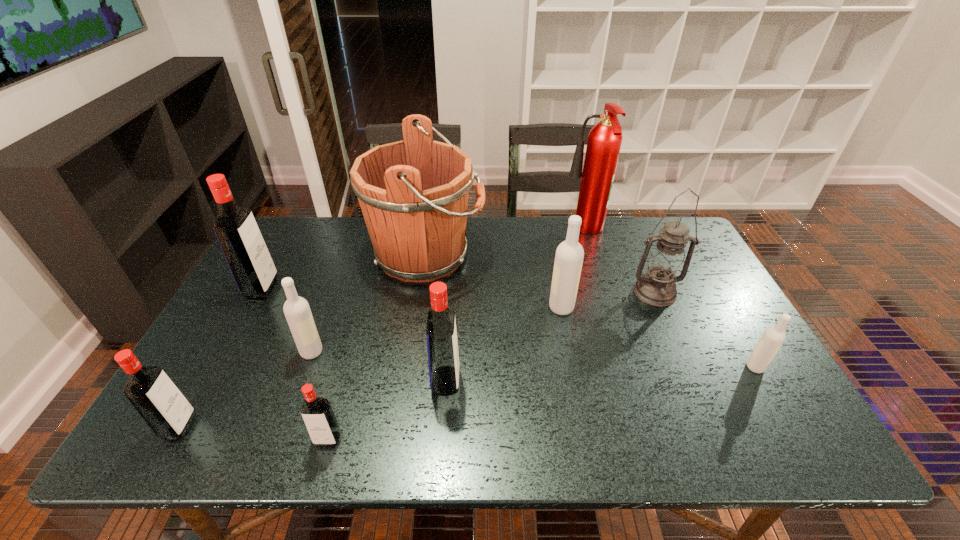
Point out which object is positioned as the nearest to the bucket. Please provide its 2D coordinates. Your answer should be formatted as a tuple, i.e. [(x, y)], where the tuple contains the x and y coordinates of a point satisfying the conditions above.

[(569, 256)]

This screenshot has width=960, height=540. What are the coordinates of `vodka object that ranks as the sixth closest to the smallest red vodka` in the screenshot? It's located at (773, 338).

Where is `vodka that is the third closest one to the rightmost vodka`? This screenshot has width=960, height=540. vodka that is the third closest one to the rightmost vodka is located at coordinates (321, 423).

Select which red vodka appears as the third closest to the third vodka from right to left. Please provide its 2D coordinates. Your answer should be formatted as a tuple, i.e. [(x, y)], where the tuple contains the x and y coordinates of a point satisfying the conditions above.

[(249, 260)]

Point out which red vodka is positioned as the nearest to the second biggest red vodka. Please provide its 2D coordinates. Your answer should be formatted as a tuple, i.e. [(x, y)], where the tuple contains the x and y coordinates of a point satisfying the conditions above.

[(321, 423)]

The width and height of the screenshot is (960, 540). What are the coordinates of `the second closest white vodka relative to the biggest red vodka` in the screenshot? It's located at (569, 256).

Identify which white vodka is the closest to the leftmost white vodka. Please provide its 2D coordinates. Your answer should be formatted as a tuple, i.e. [(x, y)], where the tuple contains the x and y coordinates of a point satisfying the conditions above.

[(569, 256)]

At what (x,y) coordinates should I click in order to perform the action: click on vacant space that satisfies the following two spatial constraints: 1. on the back side of the gray oil lamp; 2. on the left side of the biggest white vodka. Please return your answer as a coordinate pair (x, y). Looking at the image, I should click on (558, 292).

Locate an element on the screen. The image size is (960, 540). free space that satisfies the following two spatial constraints: 1. on the front and back of the rightmost object; 2. on the left side of the tallest vodka is located at coordinates (218, 367).

This screenshot has width=960, height=540. In order to click on free space that satisfies the following two spatial constraints: 1. with the handle on the side of the bucket; 2. on the front and back of the smallest red vodka in this screenshot , I will do `click(399, 438)`.